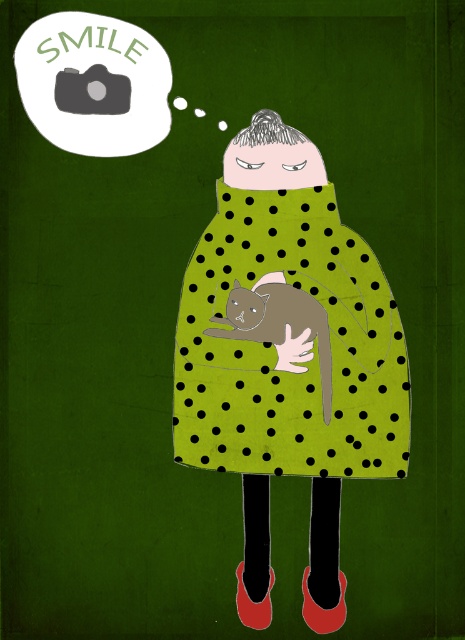
You are a photographer setting up for a photo shoot. The subject is standing on a green dotted blanket at center. You need to position your camera so that it is exactly 4.35 feet away from the blanket to capture the perfect shot. Can you adjust your camera to the correct distance?

Answer: Yes, the green dotted blanket at center is 4.35 feet from the camera, so adjusting the camera to that distance will ensure it is correctly positioned for the photo shoot.

You are organizing a photo shoot and need to place the green dotted blanket at center and the matte black camera at upper left. If the camera requires a space of 15 cm in width, what is the minimum width required for the blanket to ensure it is larger than the camera?

The green dotted blanket at center is larger in size than the matte black camera at upper left. Since the camera requires 15 cm in width, the blanket must be at least 15.1 cm wide to be larger.

You are a photographer trying to capture a candid shot of the scene. The green dotted blanket at center and green matte hand at center are both in your frame. Which object should you focus on first to ensure it is in sharp focus?

The green dotted blanket at center is closer to the viewer than the green matte hand at center, so you should focus on the green dotted blanket at center first to ensure it is in sharp focus.